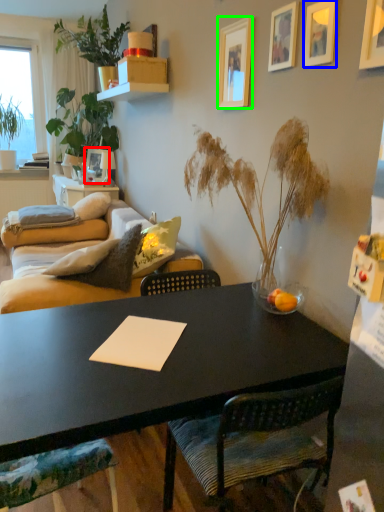
Question: Which object is positioned farthest from picture frame (highlighted by a red box)? Select from picture frame (highlighted by a blue box) and picture frame (highlighted by a green box).

Choices:
 (A) picture frame
 (B) picture frame

Answer: (A)